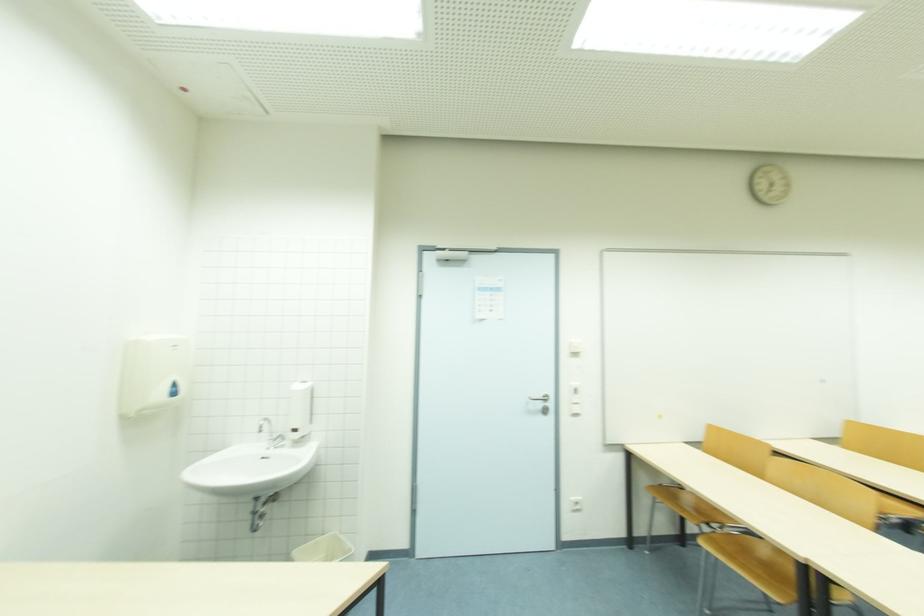
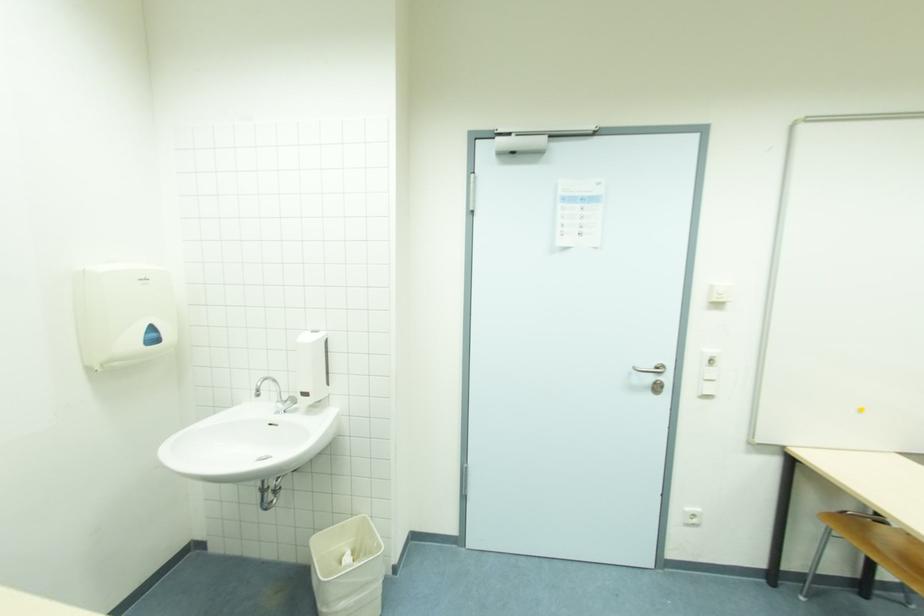
Question: The images are taken continuously from a first-person perspective. In which direction are you moving?

Choices:
 (A) Left
 (B) Right
 (C) Forward
 (D) Backward

Answer: (C)